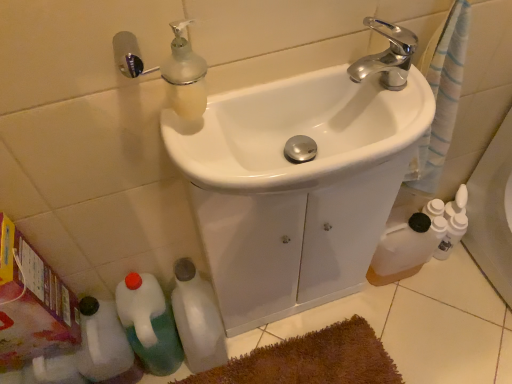
You are a GUI agent. You are given a task and a screenshot of the screen. Output one action in this format:
    pyautogui.click(x=<x>, y=<y>)
    Task: Click on the vacant space that's between white glossy sink at center, the 1th sink when ordered from back to front, and white matte bottle at lower left, which is the 3th bottle from left to right
    
    Given the screenshot: What is the action you would take?
    pyautogui.click(x=274, y=330)